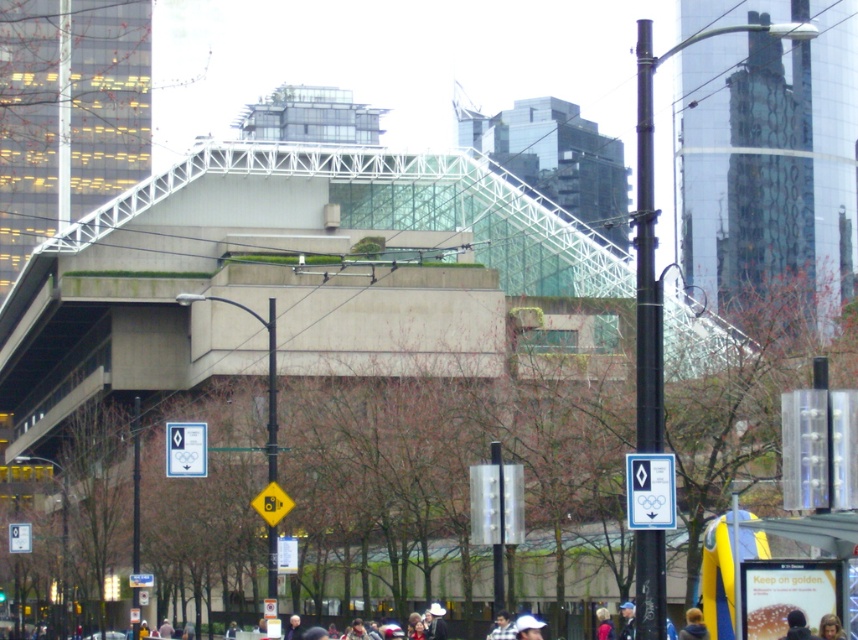
Question: Can you confirm if white plastic sign at center is positioned above blonde hair at center?

Choices:
 (A) yes
 (B) no

Answer: (A)

Question: Among these objects, which one is farthest from the camera?

Choices:
 (A) blue denim jacket at lower right
 (B) white plastic sign at center

Answer: (B)

Question: Does white plastic sign at center have a lesser width compared to blonde hair at center?

Choices:
 (A) no
 (B) yes

Answer: (A)

Question: Can you confirm if white plastic sign at center is bigger than blonde hair at center?

Choices:
 (A) no
 (B) yes

Answer: (B)

Question: Among these points, which one is nearest to the camera?

Choices:
 (A) (515, 632)
 (B) (186, 429)
 (C) (705, 634)

Answer: (C)

Question: Which object is the farthest from the white plastic sign at center?

Choices:
 (A) dark blue shirt at lower center
 (B) smooth skin face at lower right

Answer: (B)